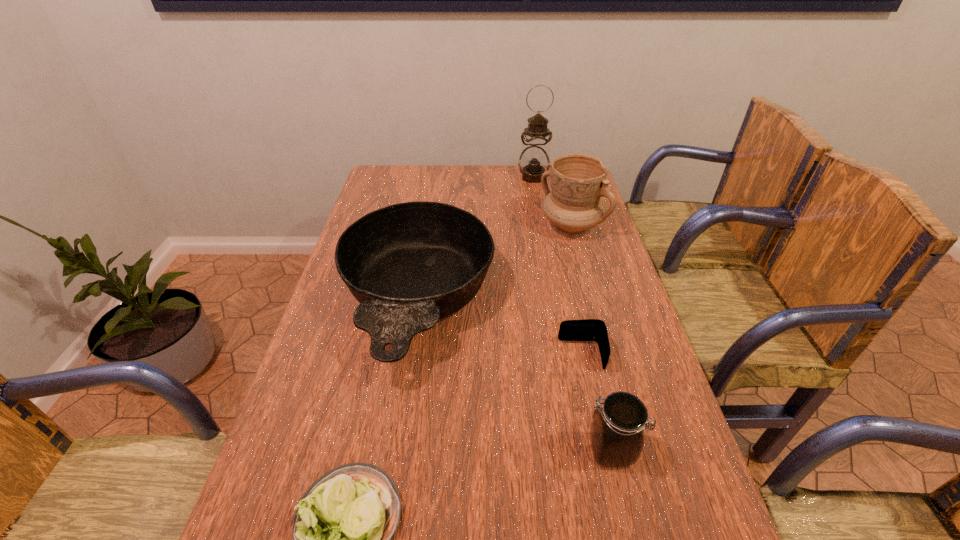
Locate an element on the screen. The image size is (960, 540). blank area located on the lid of the jar is located at coordinates (476, 450).

Locate an element on the screen. Image resolution: width=960 pixels, height=540 pixels. vacant region located on the lid of the jar is located at coordinates (397, 450).

Find the location of a particular element. This screenshot has width=960, height=540. vacant space located 0.090m on the outer surface of the wallet is located at coordinates (523, 355).

Locate an element on the screen. free space located on the outer surface of the wallet is located at coordinates (466, 355).

Where is `free point located on the outer surface of the wallet`? This screenshot has height=540, width=960. free point located on the outer surface of the wallet is located at coordinates (441, 355).

At what (x,y) coordinates should I click in order to perform the action: click on object that is at the far edge. Please return your answer as a coordinate pair (x, y). The height and width of the screenshot is (540, 960). Looking at the image, I should click on (534, 160).

Locate an element on the screen. This screenshot has height=540, width=960. object present at the left edge is located at coordinates (410, 264).

Locate an element on the screen. oil lamp that is positioned at the right edge is located at coordinates [x=534, y=160].

Locate an element on the screen. Image resolution: width=960 pixels, height=540 pixels. pottery that is at the right edge is located at coordinates (578, 181).

Where is `jar located at the right edge`? jar located at the right edge is located at coordinates (617, 430).